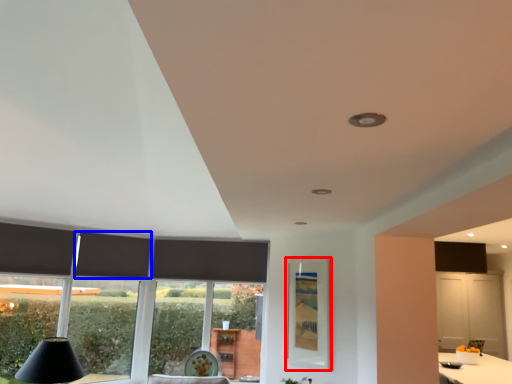
Question: Which object is closer to the camera taking this photo, window screen (highlighted by a red box) or curtain (highlighted by a blue box)?

Choices:
 (A) window screen
 (B) curtain

Answer: (A)